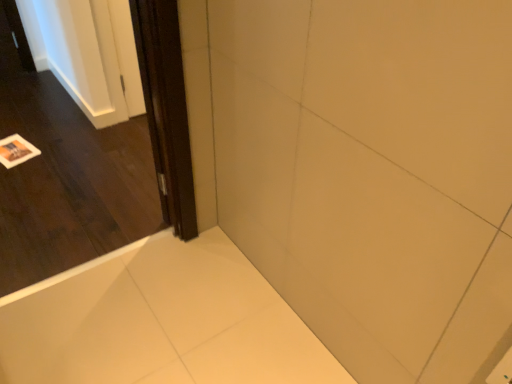
Question: From a real-world perspective, is white glossy bathtub at lower left beneath dark wood screen door at left?

Choices:
 (A) yes
 (B) no

Answer: (A)

Question: Is white glossy bathtub at lower left oriented away from dark wood screen door at left?

Choices:
 (A) no
 (B) yes

Answer: (A)

Question: Is white glossy bathtub at lower left positioned in front of dark wood screen door at left?

Choices:
 (A) no
 (B) yes

Answer: (B)

Question: Could you tell me if white glossy bathtub at lower left is turned towards dark wood screen door at left?

Choices:
 (A) yes
 (B) no

Answer: (B)

Question: Is the position of white glossy bathtub at lower left more distant than that of dark wood screen door at left?

Choices:
 (A) no
 (B) yes

Answer: (A)

Question: From a real-world perspective, is dark wood screen door at left physically located above or below white glossy bathtub at lower left?

Choices:
 (A) below
 (B) above

Answer: (B)

Question: Considering the positions of dark wood screen door at left and white glossy bathtub at lower left in the image, is dark wood screen door at left bigger or smaller than white glossy bathtub at lower left?

Choices:
 (A) big
 (B) small

Answer: (A)

Question: Is dark wood screen door at left in front of or behind white glossy bathtub at lower left in the image?

Choices:
 (A) front
 (B) behind

Answer: (B)

Question: Do you think dark wood screen door at left is within white glossy bathtub at lower left, or outside of it?

Choices:
 (A) inside
 (B) outside

Answer: (B)

Question: In terms of width, does white glossy bathtub at lower left look wider or thinner when compared to dark wood door at left?

Choices:
 (A) wide
 (B) thin

Answer: (A)

Question: From the image's perspective, is white glossy bathtub at lower left above or below dark wood door at left?

Choices:
 (A) above
 (B) below

Answer: (B)

Question: Is white glossy bathtub at lower left to the left or to the right of dark wood door at left in the image?

Choices:
 (A) left
 (B) right

Answer: (B)

Question: From a real-world perspective, relative to dark wood door at left, is white glossy bathtub at lower left vertically above or below?

Choices:
 (A) below
 (B) above

Answer: (A)

Question: From a real-world perspective, relative to white glossy bathtub at lower left, is dark wood door at left vertically above or below?

Choices:
 (A) above
 (B) below

Answer: (A)

Question: Is dark wood door at left in front of or behind white glossy bathtub at lower left in the image?

Choices:
 (A) front
 (B) behind

Answer: (A)